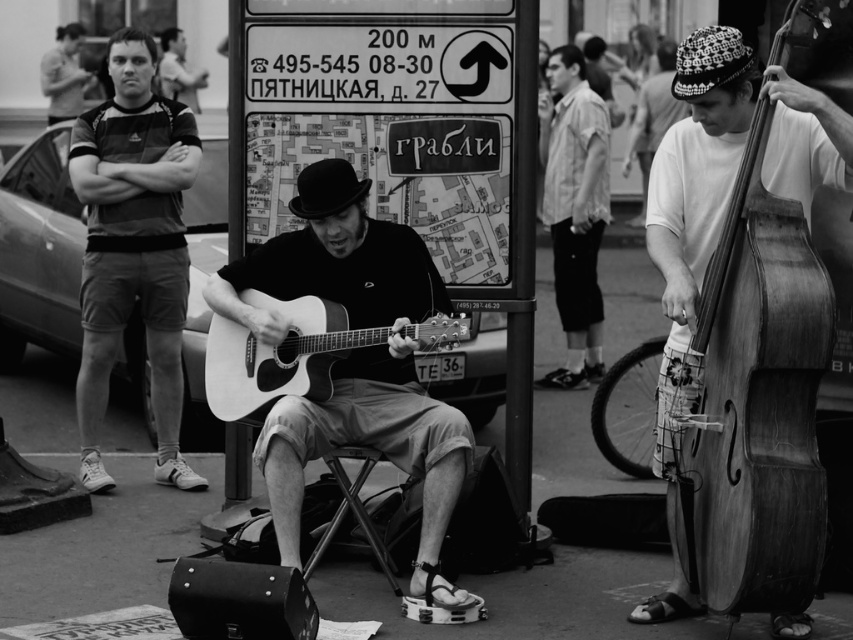
Question: Which object is closer to the camera taking this photo?

Choices:
 (A) knitted wool hat at upper right
 (B) matte gray t-shirt at left
 (C) acoustic wood guitar at center

Answer: (C)

Question: Considering the real-world distances, which object is closest to the acoustic wood guitar at center?

Choices:
 (A) matte gray t-shirt at left
 (B) striped cotton shirt at upper right
 (C) matte acoustic guitar at center

Answer: (C)

Question: Is matte acoustic guitar at center further to camera compared to matte gray t-shirt at left?

Choices:
 (A) yes
 (B) no

Answer: (B)

Question: Which point is farther from the camera taking this photo?

Choices:
 (A) (802, 420)
 (B) (323, 336)

Answer: (B)

Question: Is wooden cello at right behind matte acoustic guitar at center?

Choices:
 (A) yes
 (B) no

Answer: (B)

Question: Can you confirm if wooden cello at right is positioned above matte gray t-shirt at left?

Choices:
 (A) yes
 (B) no

Answer: (B)